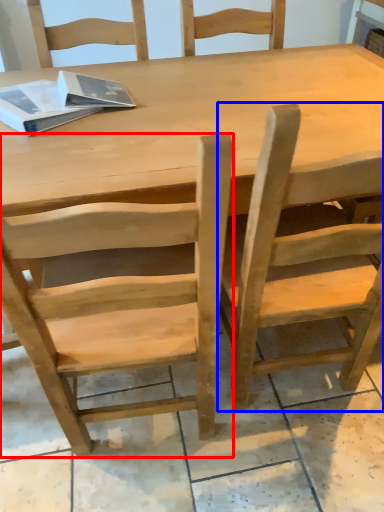
Question: Among these objects, which one is nearest to the camera, chair (highlighted by a red box) or chair (highlighted by a blue box)?

Choices:
 (A) chair
 (B) chair

Answer: (A)